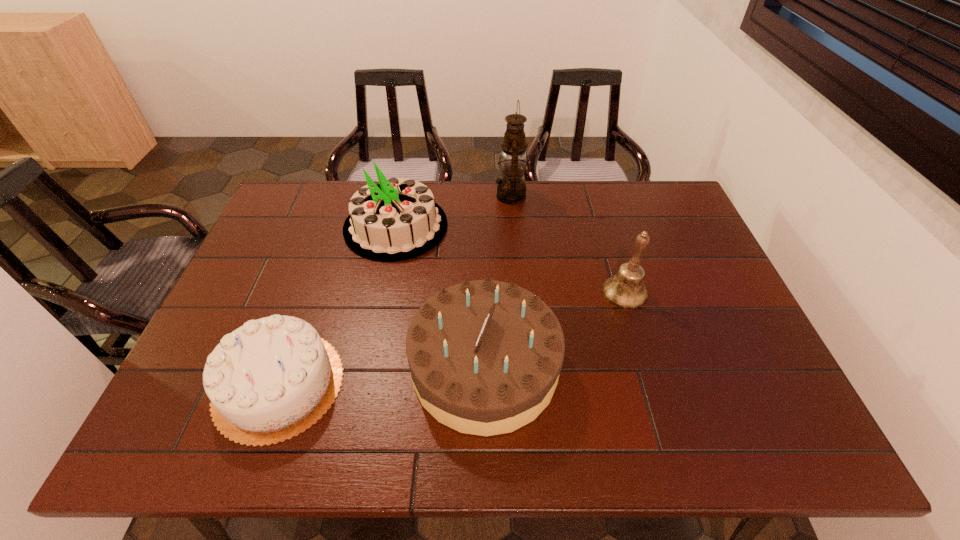
Image resolution: width=960 pixels, height=540 pixels. Identify the location of oil lamp. (511, 189).

Locate an element on the screen. the tallest birthday cake is located at coordinates (394, 219).

Find the location of `the third farthest object`. the third farthest object is located at coordinates (626, 290).

Find the location of a particular element. bell is located at coordinates (626, 290).

Find the location of a particular element. The image size is (960, 540). free space located on the front of the oil lamp is located at coordinates (516, 266).

What are the coordinates of `vacant region located on the front of the tallest birthday cake` in the screenshot? It's located at (x=381, y=298).

You are a GUI agent. You are given a task and a screenshot of the screen. Output one action in this format:
    pyautogui.click(x=<x>, y=<y>)
    Task: Click on the vacant space located on the front of the third nearest object
    
    Given the screenshot: What is the action you would take?
    pyautogui.click(x=645, y=357)

Where is `oil lamp that is positioned at the far edge`? The height and width of the screenshot is (540, 960). oil lamp that is positioned at the far edge is located at coordinates (511, 189).

At what (x,y) coordinates should I click in order to perform the action: click on birthday cake located at the far edge. Please return your answer as a coordinate pair (x, y). Looking at the image, I should click on (394, 219).

The image size is (960, 540). What are the coordinates of `object that is at the left edge` in the screenshot? It's located at (269, 380).